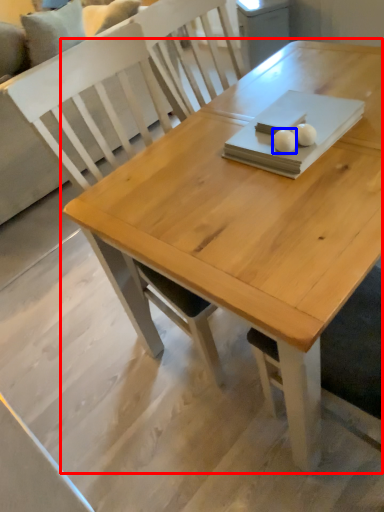
Question: Among these objects, which one is farthest to the camera, table (highlighted by a red box) or food (highlighted by a blue box)?

Choices:
 (A) table
 (B) food

Answer: (B)